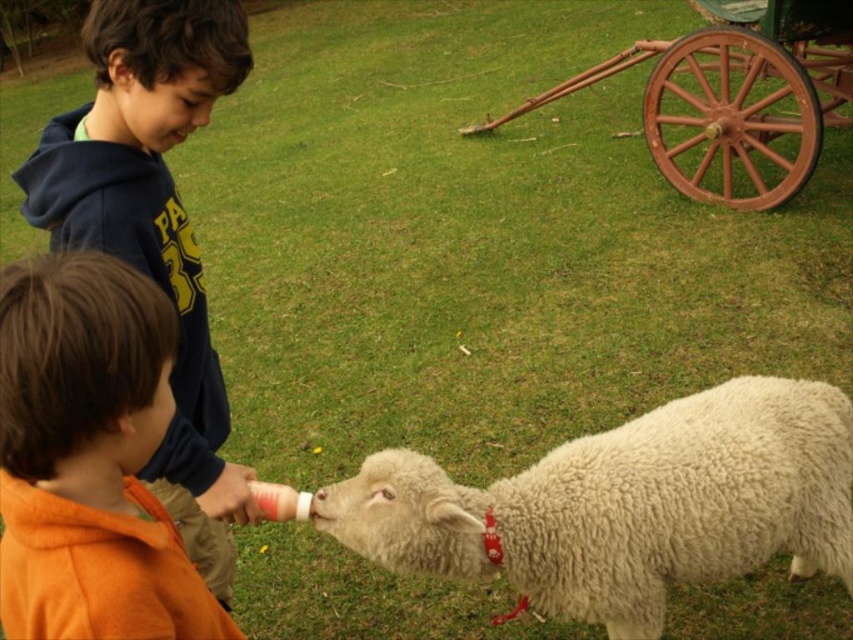
Question: Can you confirm if white fluffy sheep at lower center is bigger than orange fleece jacket at lower left?

Choices:
 (A) no
 (B) yes

Answer: (B)

Question: Which object is positioned closest to the orange fleece jacket at lower left?

Choices:
 (A) white fluffy sheep at lower center
 (B) rusty wood wagon at upper right

Answer: (A)

Question: Considering the real-world distances, which object is farthest from the orange fleece jacket at lower left?

Choices:
 (A) rusty wood wagon at upper right
 (B) white fluffy sheep at lower center

Answer: (A)

Question: From the image, what is the correct spatial relationship of white fluffy sheep at lower center in relation to orange fleece jacket at lower left?

Choices:
 (A) above
 (B) below

Answer: (B)

Question: Considering the relative positions of orange fleece jacket at lower left and rusty wood wagon at upper right in the image provided, where is orange fleece jacket at lower left located with respect to rusty wood wagon at upper right?

Choices:
 (A) right
 (B) left

Answer: (B)

Question: Which of the following is the closest to the observer?

Choices:
 (A) rusty wood wagon at upper right
 (B) orange fleece jacket at lower left

Answer: (B)